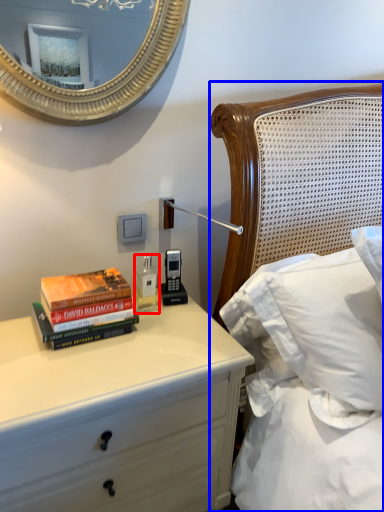
Question: Which object appears farthest to the camera in this image, bottle (highlighted by a red box) or bed (highlighted by a blue box)?

Choices:
 (A) bottle
 (B) bed

Answer: (A)